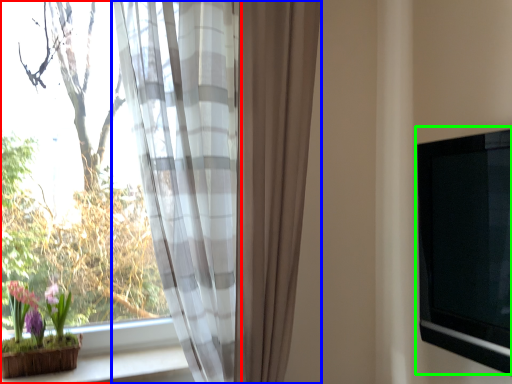
Question: Estimate the real-world distances between objects in this image. Which object is closer to window (highlighted by a red box), curtain (highlighted by a blue box) or window screen (highlighted by a green box)?

Choices:
 (A) curtain
 (B) window screen

Answer: (A)